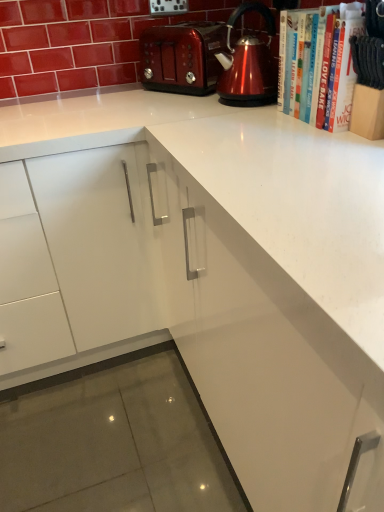
Find the location of `vacant space to the left of shiny metallic kettle at upper right`. vacant space to the left of shiny metallic kettle at upper right is located at coordinates [183, 109].